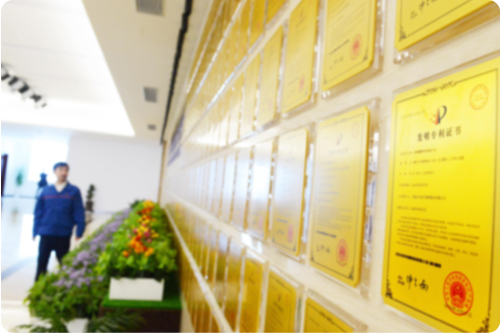
This screenshot has height=333, width=500. I want to click on floor, so click(x=14, y=226).